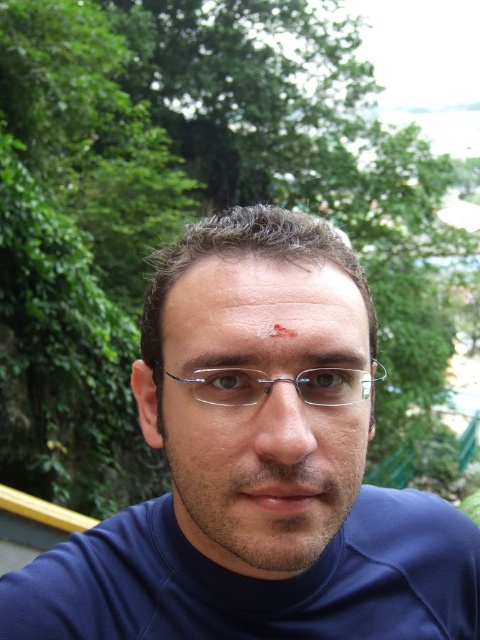
What is located at the coordinates point (256, 468) in the image?

The point (256, 468) corresponds to the location of the matte blue shirt at center.

You are a photographer adjusting your camera settings to focus on the person in the scene. Which object, the matte metallic glasses at center or the matte skin scar at center, would require a closer zoom to capture details clearly?

The matte metallic glasses at center is bigger than the matte skin scar at center, so to capture details clearly, you would need to zoom closer on the matte skin scar at center since it is smaller and might need more focus.

You are a photographer trying to capture a portrait of the person wearing the matte blue shirt at center and the clear plastic glasses at center. Given that your camera has a maximum focusing distance of 5 meters, will you be able to focus on both subjects simultaneously?

The distance between the matte blue shirt at center and clear plastic glasses at center is 8.06 meters, which exceeds the camera maximum focusing distance of 5 meters. Therefore, you cannot focus on both subjects simultaneously.